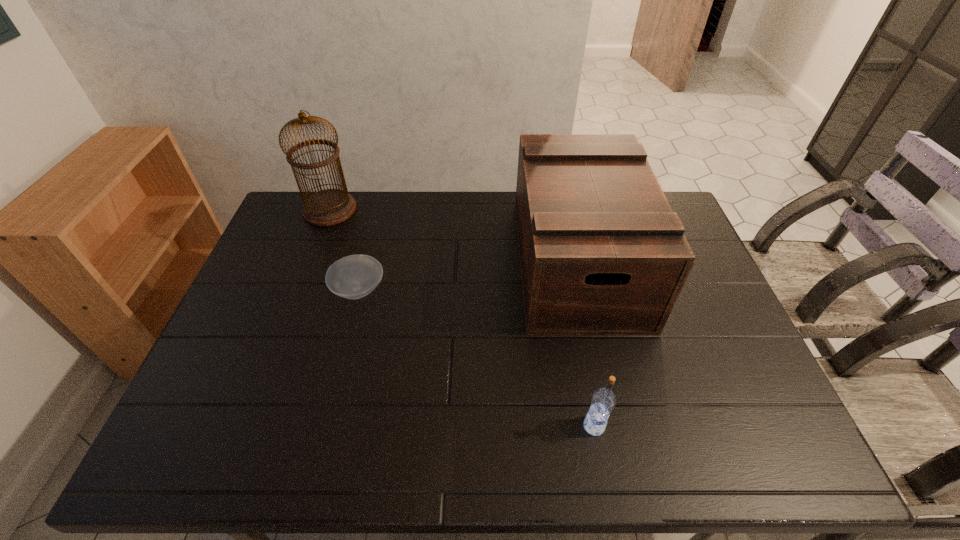
In the image, there is a desktop. Identify the location of vacant space at the near left corner. (180, 431).

This screenshot has width=960, height=540. Find the location of `free space between the second tallest object and the birdcage`. free space between the second tallest object and the birdcage is located at coordinates (453, 235).

Locate an element on the screen. This screenshot has height=540, width=960. free area in between the box and the bowl is located at coordinates (468, 276).

What are the coordinates of `free space between the nearest object and the tallest object` in the screenshot? It's located at (462, 318).

Locate an element on the screen. The width and height of the screenshot is (960, 540). free area in between the nearest object and the box is located at coordinates (586, 344).

Find the location of a particular element. This screenshot has height=540, width=960. vacant space in between the third shortest object and the nearest object is located at coordinates (586, 344).

The height and width of the screenshot is (540, 960). In order to click on free space between the leftmost object and the box in this screenshot , I will do tap(453, 235).

Locate an element on the screen. Image resolution: width=960 pixels, height=540 pixels. vacant space in between the second tallest object and the tallest object is located at coordinates [453, 235].

This screenshot has width=960, height=540. I want to click on free space between the box and the bowl, so click(468, 276).

Find the location of a particular element. This screenshot has width=960, height=540. vacant region between the second tallest object and the third tallest object is located at coordinates (586, 344).